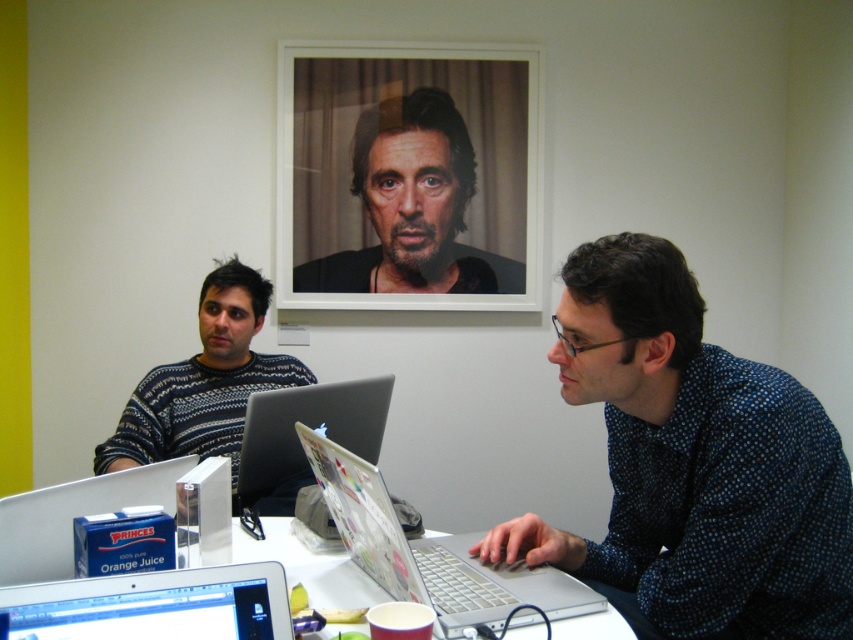
You are a delivery person who needs to place a small package between the blue dotted shirt at center and the metallic silver laptop at lower left. The package requires at least 30 inches of space to fit. Can you fit it there?

The distance between the blue dotted shirt at center and the metallic silver laptop at lower left is 28.28 inches, which is less than the required 30 inches. Therefore, the package cannot be placed there.

You are a delivery person entering the office and need to place a package on the table. The package must be placed below the blue dotted shirt at center and above the metallic silver laptop at lower left. Is there enough vertical space between them to fit the package?

The blue dotted shirt at center is above the metallic silver laptop at lower left, so there is vertical space between them. The package can be placed below the blue dotted shirt at center and above the metallic silver laptop at lower left.

You are standing in front of the table in the office scene. You want to reach the silver metallic laptop at center to retrieve a pen that was accidentally dropped underneath it. Considering the laptop is 3.30 feet away from you, can you comfortably slide your hand under it to retrieve the pen without moving the laptop?

The silver metallic laptop at center is 3.30 feet from viewer, so yes, you can comfortably slide your hand under it to retrieve the pen without moving the laptop since the distance allows enough space for your hand to reach underneath.